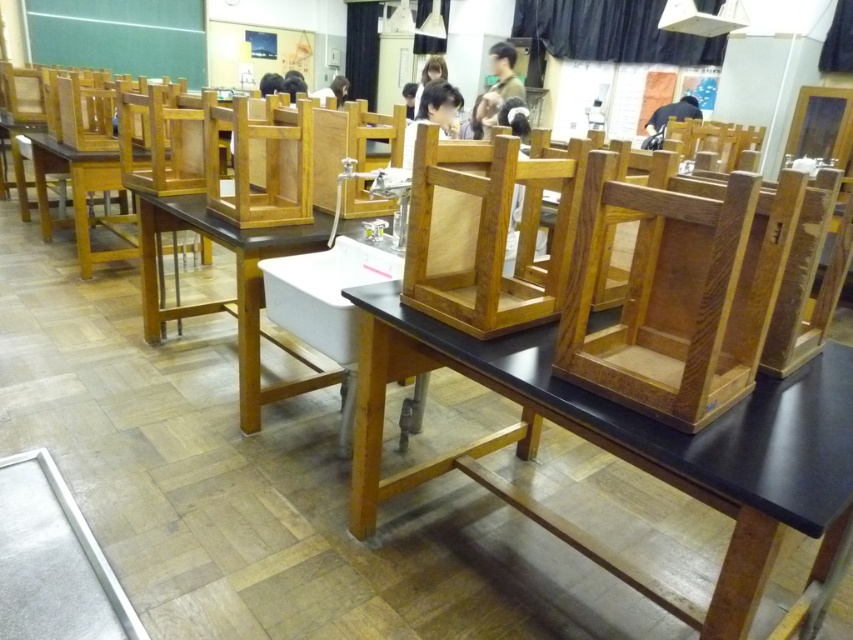
You are standing in the classroom and want to reach the point at coordinates (x=306, y=237). If your walking speed is 3 feet per second, how many seconds will it take you to reach that point?

The point at coordinates (x=306, y=237) is 7.98 feet away from you. At a walking speed of 3 feet per second, it would take approximately 2.66 seconds to reach the point.

You are a student carrying a heavy textbook and need to place it between the wooden frame at center and the wooden chair at center. Is there enough space between them to fit the textbook?

The wooden frame at center and wooden chair at center are 11.75 inches apart from each other. If the textbook is thinner than 11.75 inches, it can fit between them.